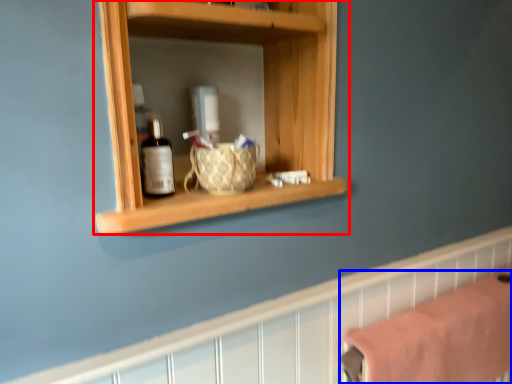
Question: Among these objects, which one is farthest to the camera, shelf (highlighted by a red box) or bath towel (highlighted by a blue box)?

Choices:
 (A) shelf
 (B) bath towel

Answer: (B)